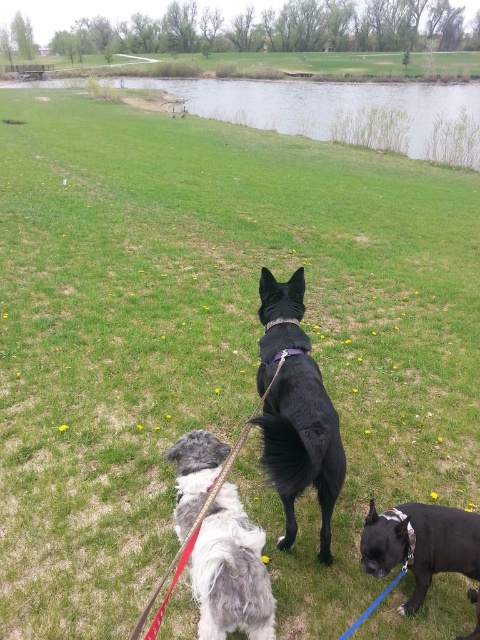
Question: Which point appears closest to the camera in this image?

Choices:
 (A) (264, 285)
 (B) (238, 100)
 (C) (220, 481)

Answer: (C)

Question: Is shiny black dog at lower right thinner than leather rope leash at center?

Choices:
 (A) yes
 (B) no

Answer: (B)

Question: Which object is closer to the camera taking this photo?

Choices:
 (A) shiny black dog at lower right
 (B) green grassy bank at upper center
 (C) black smooth fur dog at center

Answer: (C)

Question: From the image, what is the correct spatial relationship of fluffy gray fur at center in relation to shiny black dog at lower right?

Choices:
 (A) above
 (B) below

Answer: (A)

Question: Which object appears farthest from the camera in this image?

Choices:
 (A) leather rope leash at center
 (B) black smooth fur dog at center
 (C) green grassy bank at upper center

Answer: (C)

Question: Is green grassy bank at upper center above leather rope leash at center?

Choices:
 (A) no
 (B) yes

Answer: (B)